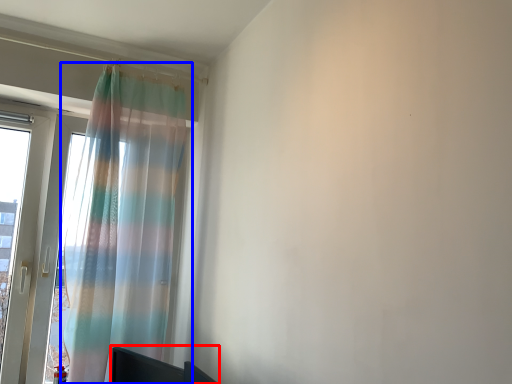
Question: Which object appears closest to the camera in this image, furniture (highlighted by a red box) or curtain (highlighted by a blue box)?

Choices:
 (A) furniture
 (B) curtain

Answer: (A)